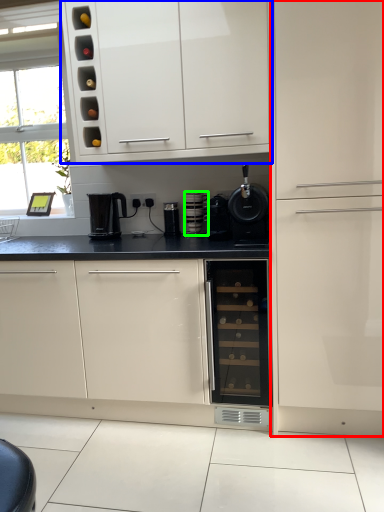
Question: Estimate the real-world distances between objects in this image. Which object is closer to cabinetry (highlighted by a red box), cabinetry (highlighted by a blue box) or kitchen appliance (highlighted by a green box)?

Choices:
 (A) cabinetry
 (B) kitchen appliance

Answer: (A)